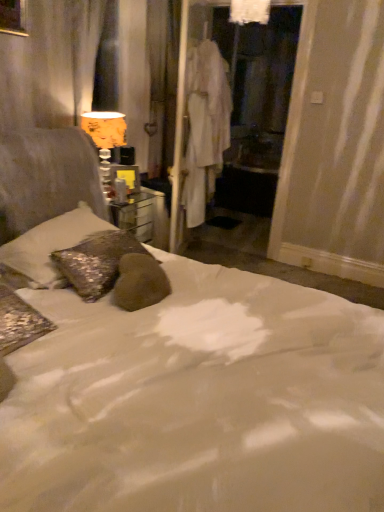
This screenshot has height=512, width=384. Find the location of `orange fabric lampshade at upper left`. orange fabric lampshade at upper left is located at coordinates (105, 140).

This screenshot has width=384, height=512. What are the coordinates of `sparkly silver pillow at left` in the screenshot? It's located at (47, 248).

This screenshot has width=384, height=512. What do you see at coordinates (287, 131) in the screenshot?
I see `white fabric screen door at center` at bounding box center [287, 131].

The image size is (384, 512). In order to click on white fabric robe at center in this screenshot , I will do `click(205, 127)`.

What's the angular difference between sparkly silver pillow at left and white fabric screen door at center's facing directions?

The angular difference between sparkly silver pillow at left and white fabric screen door at center is 91 degrees.

Between sparkly silver pillow at left and white fabric screen door at center, which one has smaller size?

sparkly silver pillow at left is smaller.

Is sparkly silver pillow at left taller or shorter than white fabric screen door at center?

In the image, sparkly silver pillow at left appears to be shorter than white fabric screen door at center.

Is sparkly silver pillow at left in front of white fabric screen door at center?

Yes, the depth of sparkly silver pillow at left is less than that of white fabric screen door at center.

Would you consider sparkly silver pillow at left to be distant from orange fabric lampshade at upper left?

No, sparkly silver pillow at left is not far away from orange fabric lampshade at upper left.

Is orange fabric lampshade at upper left located within sparkly silver pillow at left?

No, sparkly silver pillow at left does not contain orange fabric lampshade at upper left.

Who is smaller, sparkly silver pillow at left or orange fabric lampshade at upper left?

orange fabric lampshade at upper left is smaller.

From a real-world perspective, which is physically above, sparkly silver pillow at left or orange fabric lampshade at upper left?

In real-world perspective, orange fabric lampshade at upper left is above.

Is white fabric robe at center aimed at orange fabric lampshade at upper left?

No, white fabric robe at center does not turn towards orange fabric lampshade at upper left.

Are white fabric robe at center and orange fabric lampshade at upper left far apart?

They are positioned close to each other.

At what (x,y) coordinates should I click in order to perform the action: click on table lamp directly beneath the white fabric robe at center (from a real-world perspective). Please return your answer as a coordinate pair (x, y). Looking at the image, I should click on (105, 140).

Does point (208, 81) come closer to viewer compared to point (100, 130)?

No, it is behind (100, 130).

Considering their positions, is white fabric screen door at center located in front of or behind sparkly silver pillow at left?

white fabric screen door at center is behind sparkly silver pillow at left.

From a real-world perspective, who is located lower, white fabric screen door at center or sparkly silver pillow at left?

In real-world perspective, sparkly silver pillow at left is lower.

Considering the relative sizes of white fabric screen door at center and sparkly silver pillow at left in the image provided, is white fabric screen door at center shorter than sparkly silver pillow at left?

In fact, white fabric screen door at center may be taller than sparkly silver pillow at left.

Considering the relative sizes of white fabric screen door at center and sparkly silver pillow at left in the image provided, is white fabric screen door at center thinner than sparkly silver pillow at left?

Indeed, white fabric screen door at center has a lesser width compared to sparkly silver pillow at left.

Between orange fabric lampshade at upper left and white fabric screen door at center, which one has larger width?

With larger width is orange fabric lampshade at upper left.

The height and width of the screenshot is (512, 384). In order to click on screen door behind the orange fabric lampshade at upper left in this screenshot , I will do `click(287, 131)`.

In terms of size, does orange fabric lampshade at upper left appear bigger or smaller than white fabric screen door at center?

orange fabric lampshade at upper left is smaller than white fabric screen door at center.

From a real-world perspective, is sparkly silver pillow at left on top of white fabric robe at center?

Actually, sparkly silver pillow at left is physically below white fabric robe at center in the real world.

Which of these two, sparkly silver pillow at left or white fabric robe at center, stands shorter?

Standing shorter between the two is sparkly silver pillow at left.

Considering the relative positions of sparkly silver pillow at left and white fabric robe at center in the image provided, is sparkly silver pillow at left to the right of white fabric robe at center from the viewer's perspective?

Incorrect, sparkly silver pillow at left is not on the right side of white fabric robe at center.

Is sparkly silver pillow at left directly adjacent to white fabric robe at center?

No, sparkly silver pillow at left is not in contact with white fabric robe at center.

Is white fabric robe at center at the back of white fabric screen door at center?

Yes, white fabric screen door at center is positioned with its back facing white fabric robe at center.

From a real-world perspective, who is located higher, white fabric screen door at center or white fabric robe at center?

white fabric screen door at center.

Who is shorter, white fabric screen door at center or white fabric robe at center?

white fabric robe at center is shorter.

I want to click on pillow below the white fabric screen door at center (from the image's perspective), so click(x=47, y=248).

Where is `table lamp behind the sparkly silver pillow at left`? Image resolution: width=384 pixels, height=512 pixels. table lamp behind the sparkly silver pillow at left is located at coordinates point(105,140).

Based on their spatial positions, is orange fabric lampshade at upper left or sparkly silver pillow at left further from white fabric screen door at center?

The object further to white fabric screen door at center is sparkly silver pillow at left.

From the image, which object appears to be nearer to white fabric robe at center, sparkly silver pillow at left or orange fabric lampshade at upper left?

The object closer to white fabric robe at center is orange fabric lampshade at upper left.

Consider the image. Based on their spatial positions, is orange fabric lampshade at upper left or white fabric robe at center further from sparkly silver pillow at left?

white fabric robe at center is positioned further to the anchor sparkly silver pillow at left.

When comparing their distances from white fabric screen door at center, does orange fabric lampshade at upper left or white fabric robe at center seem further?

orange fabric lampshade at upper left lies further to white fabric screen door at center than the other object.

Looking at the image, which one is located further to sparkly silver pillow at left, orange fabric lampshade at upper left or white fabric screen door at center?

white fabric screen door at center lies further to sparkly silver pillow at left than the other object.

Which object lies further to the anchor point sparkly silver pillow at left, white fabric robe at center or orange fabric lampshade at upper left?

white fabric robe at center is positioned further to the anchor sparkly silver pillow at left.

When comparing their distances from white fabric robe at center, does orange fabric lampshade at upper left or white fabric screen door at center seem closer?

white fabric screen door at center lies closer to white fabric robe at center than the other object.

Which object lies nearer to the anchor point orange fabric lampshade at upper left, sparkly silver pillow at left or white fabric screen door at center?

sparkly silver pillow at left is positioned closer to the anchor orange fabric lampshade at upper left.

Find the location of `robe between sparkly silver pillow at left and white fabric screen door at center from front to back`. robe between sparkly silver pillow at left and white fabric screen door at center from front to back is located at coordinates (205, 127).

Identify the location of table lamp located between sparkly silver pillow at left and white fabric screen door at center in the depth direction. (105, 140).

Where is `robe situated between orange fabric lampshade at upper left and white fabric screen door at center from left to right`? The width and height of the screenshot is (384, 512). robe situated between orange fabric lampshade at upper left and white fabric screen door at center from left to right is located at coordinates (205, 127).

In order to click on table lamp located between sparkly silver pillow at left and white fabric robe at center in the depth direction in this screenshot , I will do `click(105, 140)`.